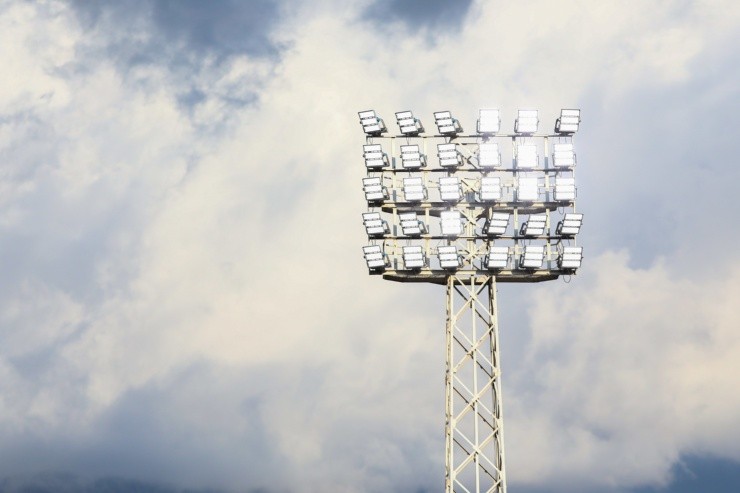
I want to click on spotlight in top row, so click(x=373, y=125), click(x=408, y=126), click(x=444, y=124), click(x=491, y=124), click(x=531, y=125), click(x=564, y=122).